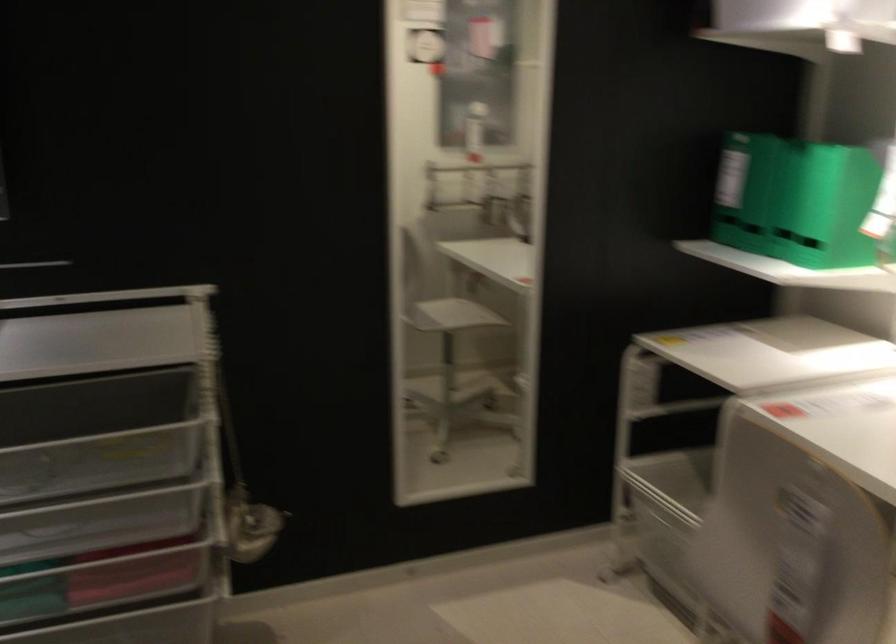
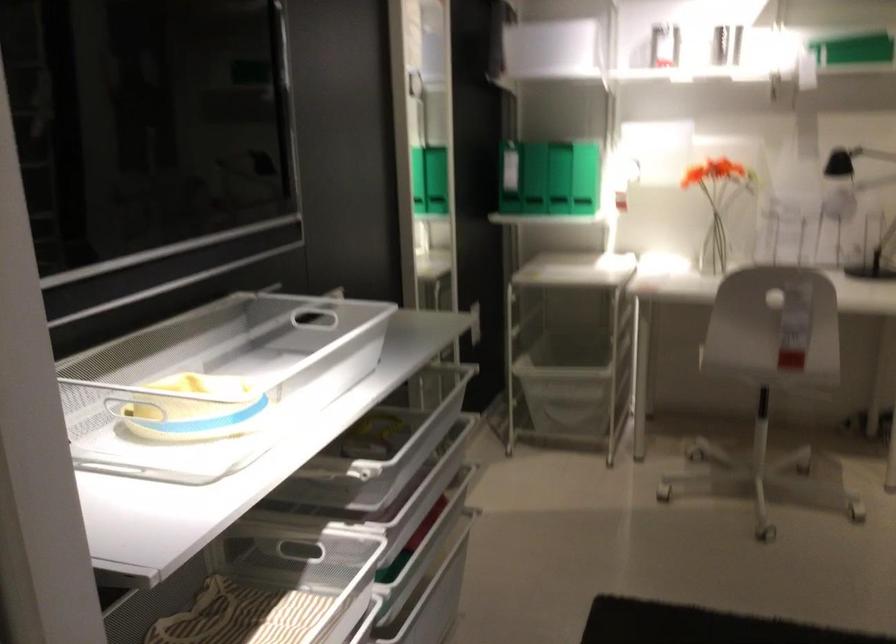
Locate, in the second image, the point that corresponds to the point at 713,194 in the first image.

(511, 174)